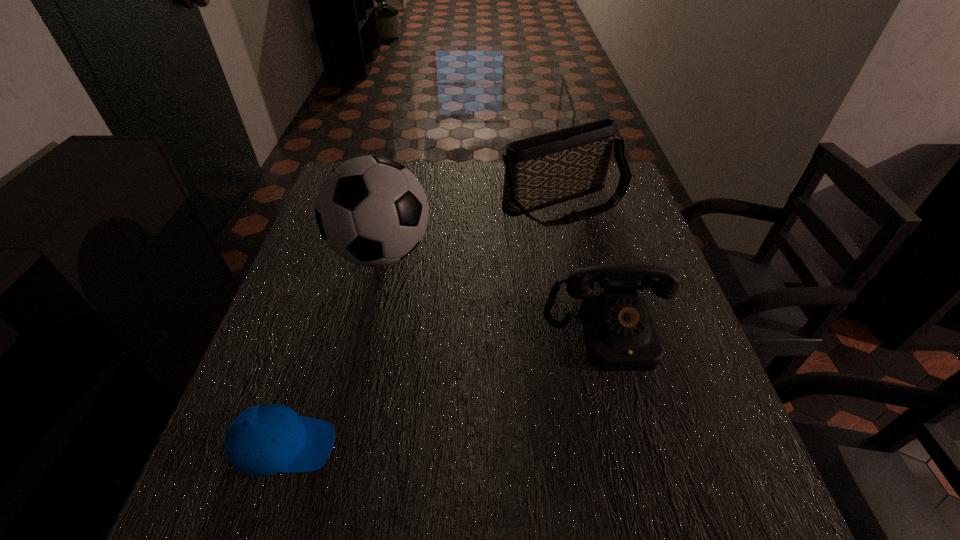
What are the coordinates of `object at the far edge` in the screenshot? It's located at (543, 170).

Locate an element on the screen. object present at the near edge is located at coordinates (262, 440).

Where is `soccer ball positioned at the left edge`? Image resolution: width=960 pixels, height=540 pixels. soccer ball positioned at the left edge is located at coordinates (372, 211).

What are the coordinates of `cap that is positioned at the left edge` in the screenshot? It's located at (262, 440).

Image resolution: width=960 pixels, height=540 pixels. What are the coordinates of `handbag located at the right edge` in the screenshot? It's located at (543, 170).

The height and width of the screenshot is (540, 960). Identify the location of telephone at the right edge. (620, 335).

Locate an element on the screen. The width and height of the screenshot is (960, 540). object that is at the near left corner is located at coordinates (262, 440).

Locate an element on the screen. The width and height of the screenshot is (960, 540). object that is positioned at the far right corner is located at coordinates (543, 170).

At what (x,y) coordinates should I click in order to perform the action: click on vacant space at the far edge of the desktop. Please return your answer as a coordinate pair (x, y). Looking at the image, I should click on (405, 165).

In the image, there is a desktop. Where is `vacant space at the near edge`? vacant space at the near edge is located at coordinates (561, 511).